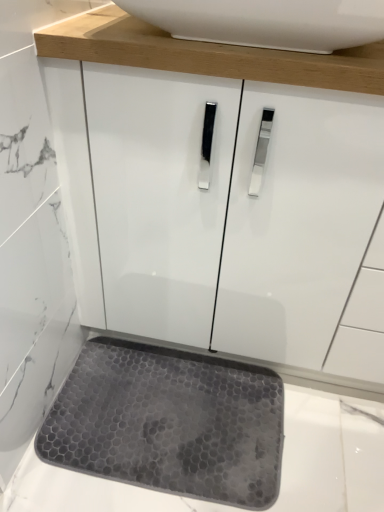
Question: Looking at their shapes, would you say white glossy sink at upper center is wider or thinner than gray rubber mat at lower center?

Choices:
 (A) wide
 (B) thin

Answer: (B)

Question: Considering the positions of white glossy sink at upper center and gray rubber mat at lower center in the image, is white glossy sink at upper center taller or shorter than gray rubber mat at lower center?

Choices:
 (A) tall
 (B) short

Answer: (A)

Question: From the image's perspective, is white glossy sink at upper center above or below gray rubber mat at lower center?

Choices:
 (A) below
 (B) above

Answer: (B)

Question: From a real-world perspective, relative to white glossy sink at upper center, is gray rubber mat at lower center vertically above or below?

Choices:
 (A) below
 (B) above

Answer: (A)

Question: In terms of width, does gray rubber mat at lower center look wider or thinner when compared to white glossy sink at upper center?

Choices:
 (A) thin
 (B) wide

Answer: (B)

Question: Is point (182, 356) positioned closer to the camera than point (291, 36)?

Choices:
 (A) closer
 (B) farther

Answer: (B)

Question: Which is correct: gray rubber mat at lower center is inside white glossy sink at upper center, or outside of it?

Choices:
 (A) outside
 (B) inside

Answer: (A)